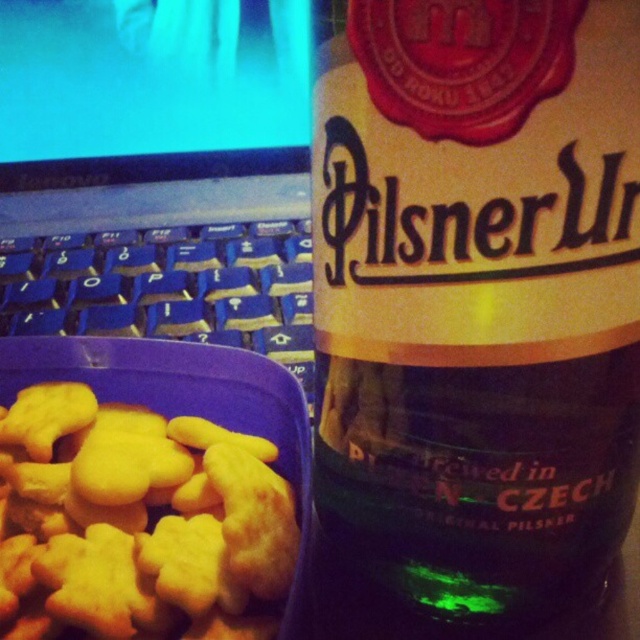
Between dark amber glass bottle at upper right and yellow matte cookie at center-left, which one has more height?

Standing taller between the two is dark amber glass bottle at upper right.

Which of these two, dark amber glass bottle at upper right or yellow matte cookie at center-left, stands shorter?

yellow matte cookie at center-left

Which is in front, point (474, 248) or point (161, 506)?

Positioned in front is point (474, 248).

Locate an element on the screen. This screenshot has height=640, width=640. dark amber glass bottle at upper right is located at coordinates (477, 292).

Does blue plastic keyboard at lower left have a larger size compared to yellow matte cookie at center-left?

Yes.

Which is in front, point (300, 56) or point (276, 504)?

Point (276, 504) is in front.

Where is `blue plastic keyboard at lower left`? The height and width of the screenshot is (640, 640). blue plastic keyboard at lower left is located at coordinates (157, 172).

Can you confirm if yellow matte cookie at center-left is shorter than blue plastic keyboard at left?

Correct, yellow matte cookie at center-left is not as tall as blue plastic keyboard at left.

Is yellow matte cookie at center-left to the left of blue plastic keyboard at left from the viewer's perspective?

No, yellow matte cookie at center-left is not to the left of blue plastic keyboard at left.

Where is `yellow matte cookie at center-left`? The width and height of the screenshot is (640, 640). yellow matte cookie at center-left is located at coordinates (136, 522).

Identify the location of yellow matte cookie at center-left. (136, 522).